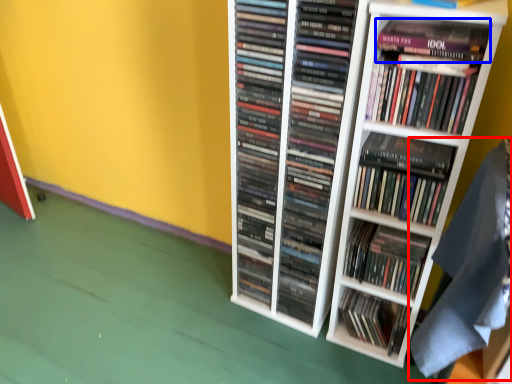
Question: Which point is further to the camera, material (highlighted by a red box) or paperback book (highlighted by a blue box)?

Choices:
 (A) material
 (B) paperback book

Answer: (B)